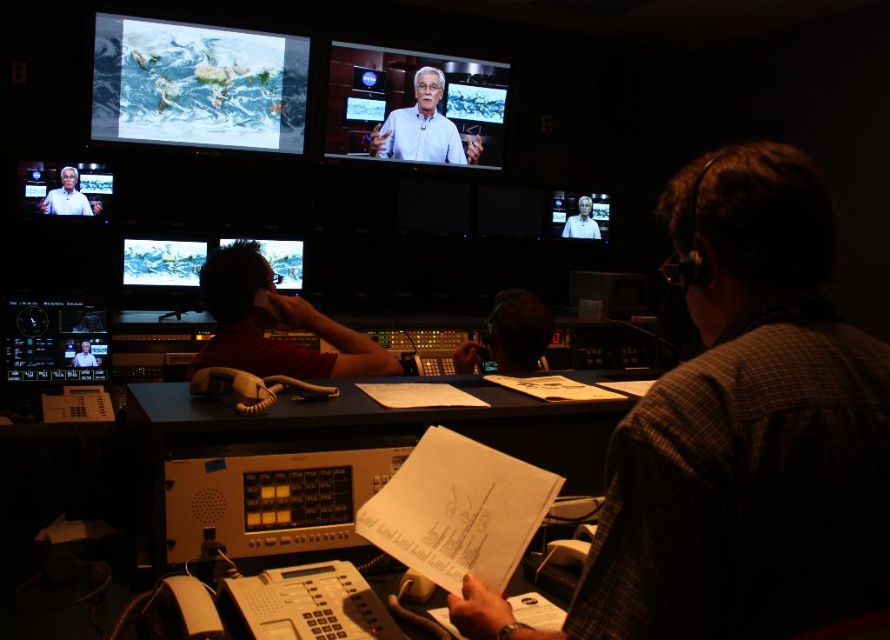
Does matte black monitor at lower left lie behind matte white shirt at upper left?

No, matte black monitor at lower left is in front of matte white shirt at upper left.

Is matte black monitor at lower left taller than matte white shirt at upper left?

Yes, matte black monitor at lower left is taller than matte white shirt at upper left.

At what (x,y) coordinates should I click in order to perform the action: click on matte black monitor at lower left. Please return your answer as a coordinate pair (x, y). Looking at the image, I should click on (55, 340).

Which is behind, point (47, 330) or point (274, 252)?

The point (274, 252) is behind.

Where is `matte black monitor at lower left`? The width and height of the screenshot is (890, 640). matte black monitor at lower left is located at coordinates (55, 340).

Is matte black monitor at lower left below matte black monitor at upper left?

Actually, matte black monitor at lower left is above matte black monitor at upper left.

The height and width of the screenshot is (640, 890). Find the location of `matte black monitor at lower left`. matte black monitor at lower left is located at coordinates (55, 340).